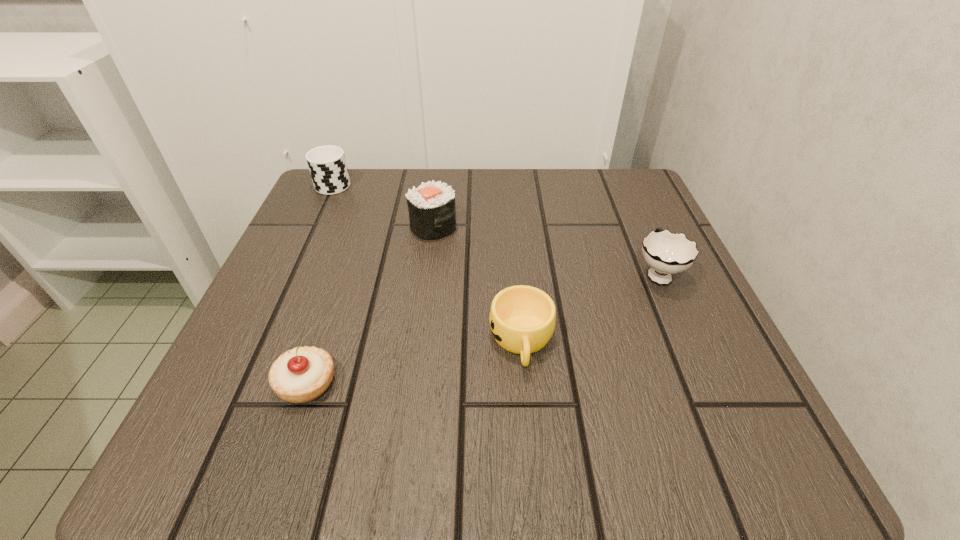
At what (x,y) coordinates should I click in order to perform the action: click on object that is the closest to the sushi. Please return your answer as a coordinate pair (x, y). Looking at the image, I should click on (327, 165).

Select which object is the third closest to the second farthest cup. Please provide its 2D coordinates. Your answer should be formatted as a tuple, i.e. [(x, y)], where the tuple contains the x and y coordinates of a point satisfying the conditions above.

[(302, 374)]

I want to click on the closest cup to the nearest cup, so click(667, 253).

Select which cup is the second closest to the fourth nearest object. Please provide its 2D coordinates. Your answer should be formatted as a tuple, i.e. [(x, y)], where the tuple contains the x and y coordinates of a point satisfying the conditions above.

[(522, 318)]